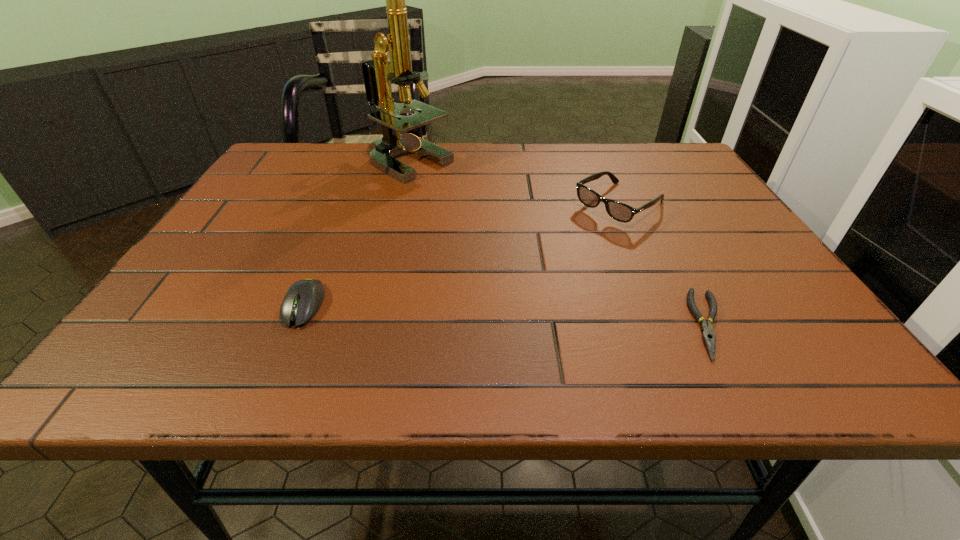
Where is `computer mouse`? computer mouse is located at coordinates (304, 298).

Locate an element on the screen. This screenshot has height=540, width=960. pliers is located at coordinates (707, 329).

Identify the location of microscope. [x=377, y=72].

What are the coordinates of `spectacles` in the screenshot? It's located at (621, 212).

Image resolution: width=960 pixels, height=540 pixels. In order to click on vacant region located on the left of the shortest object in this screenshot , I will do `click(601, 324)`.

Locate an element on the screen. blank area located 0.280m at the eyepiece of the microscope is located at coordinates (457, 242).

At what (x,y) coordinates should I click in order to perform the action: click on blank space located 0.180m at the eyepiece of the microscope. Please return your answer as a coordinate pair (x, y). Looking at the image, I should click on (443, 218).

Where is `free space located at the eyepiece of the microscope`? The height and width of the screenshot is (540, 960). free space located at the eyepiece of the microscope is located at coordinates (472, 266).

Find the location of `free space located 0.260m on the lenses of the spectacles`. free space located 0.260m on the lenses of the spectacles is located at coordinates (515, 275).

Identify the location of free spot located 0.400m on the lenses of the spectacles. (462, 310).